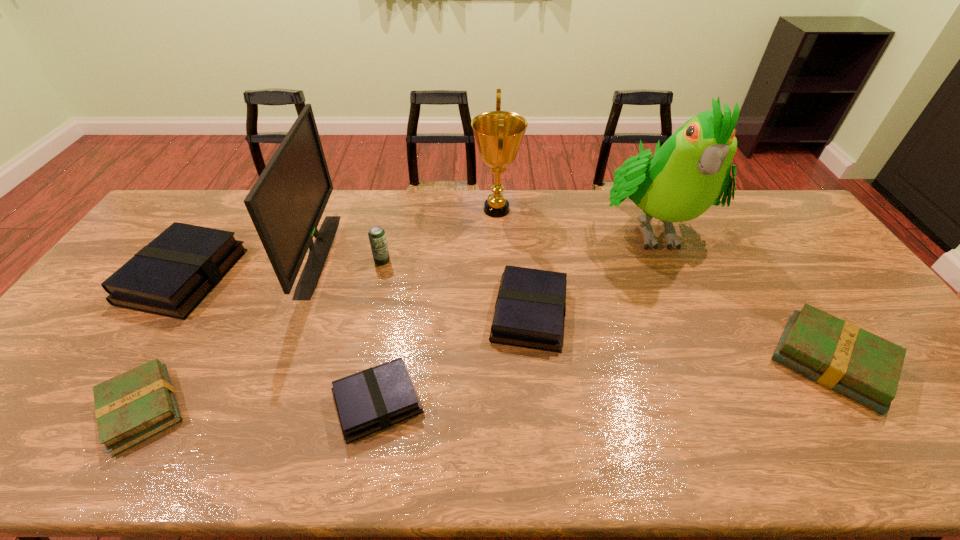
Image resolution: width=960 pixels, height=540 pixels. I want to click on the rightmost book, so click(x=866, y=368).

Locate an element on the screen. This screenshot has width=960, height=540. the second blue book from left to right is located at coordinates (376, 398).

Locate an element on the screen. the third book from left to right is located at coordinates (376, 398).

Where is `the smaller yellow book`? The height and width of the screenshot is (540, 960). the smaller yellow book is located at coordinates (130, 408).

Find the location of `vacant space located 0.060m on the beak of the green parakeet`. vacant space located 0.060m on the beak of the green parakeet is located at coordinates (679, 290).

You are a GUI agent. You are given a task and a screenshot of the screen. Output one action in this format:
    pyautogui.click(x=<x>, y=<y>)
    Task: Click on the vacant space positioned 0.360m on the front view with handles of the gold award
    Image resolution: width=960 pixels, height=540 pixels.
    Given the screenshot: What is the action you would take?
    pyautogui.click(x=372, y=210)

Locate an element on the screen. vacant region located 0.110m on the front view with handles of the gold award is located at coordinates (442, 210).

Image resolution: width=960 pixels, height=540 pixels. Find the location of `vacant space located on the front view with handles of the gold award`. vacant space located on the front view with handles of the gold award is located at coordinates (360, 210).

Find the location of a particular element. free point located on the front-facing side of the monitor is located at coordinates (407, 254).

You are a GUI agent. You are given a task and a screenshot of the screen. Output one action in this format:
    pyautogui.click(x=<x>, y=<y>)
    Task: Click on the vacant space located on the back of the sixth shortest object
    The width and height of the screenshot is (960, 540).
    Given the screenshot: What is the action you would take?
    pyautogui.click(x=397, y=195)